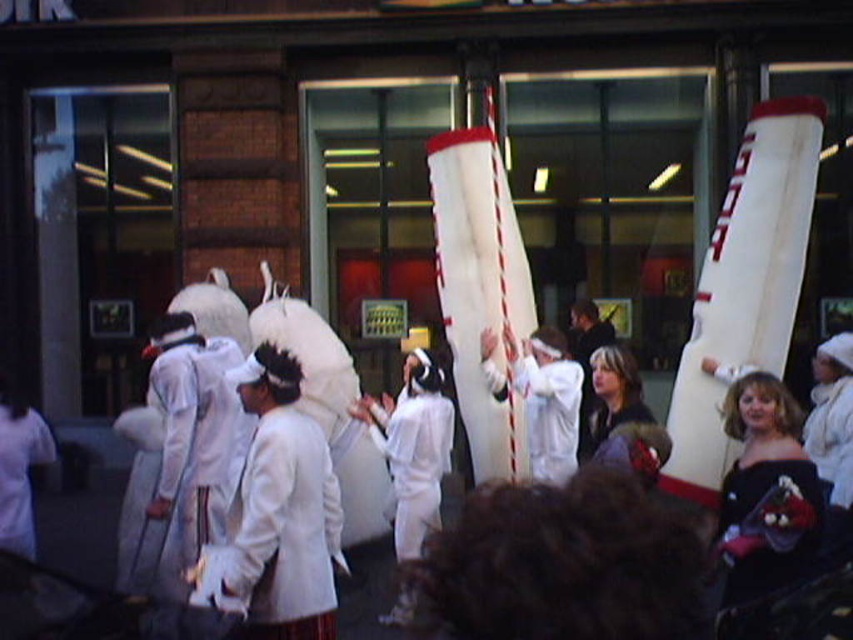
Question: Which point appears closest to the camera in this image?

Choices:
 (A) (18, 417)
 (B) (577, 348)

Answer: (A)

Question: Which point is closer to the camera?

Choices:
 (A) (50, 442)
 (B) (582, 381)

Answer: (A)

Question: Can you confirm if white satin coat at center is thinner than white feathered headdress at center?

Choices:
 (A) no
 (B) yes

Answer: (A)

Question: In this image, where is white matte pole at center located relative to white matte/soft fabric costume at left?

Choices:
 (A) right
 (B) left

Answer: (A)

Question: Which point is closer to the camera taking this photo?

Choices:
 (A) (558, 472)
 (B) (277, 628)
 (C) (607, 339)
 (D) (3, 461)

Answer: (B)

Question: Is the position of white matte pole at center more distant than that of white feathered headdress at center?

Choices:
 (A) yes
 (B) no

Answer: (B)